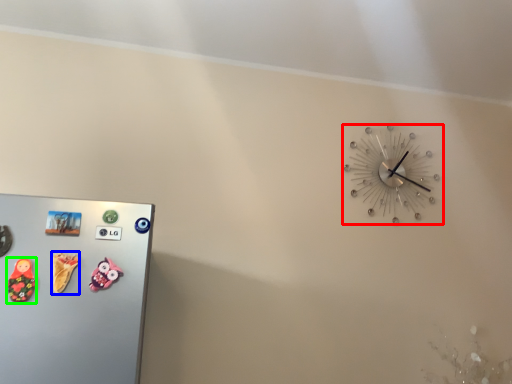
Question: Estimate the real-world distances between objects in this image. Which object is farther from wall clock (highlighted by a red box), toy (highlighted by a blue box) or toy (highlighted by a green box)?

Choices:
 (A) toy
 (B) toy

Answer: (B)